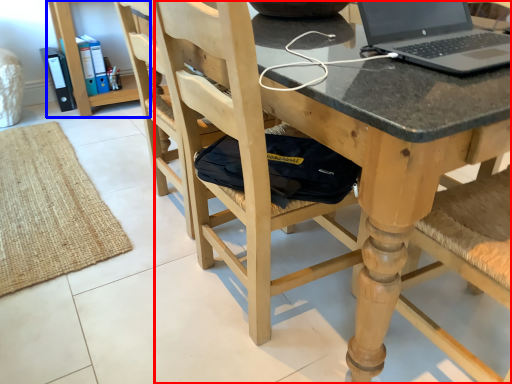
Question: Which object appears closest to the camera in this image, chair (highlighted by a red box) or bookshelf (highlighted by a blue box)?

Choices:
 (A) chair
 (B) bookshelf

Answer: (A)